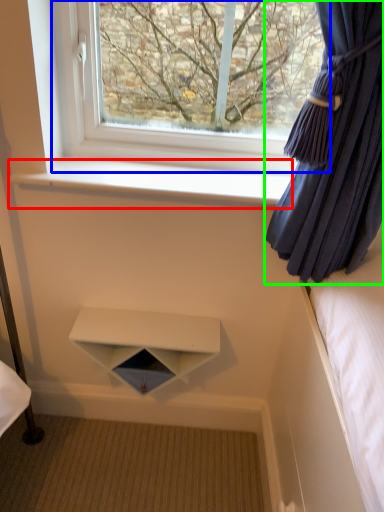
Question: Considering the real-world distances, which object is closest to window sill (highlighted by a red box)? window (highlighted by a blue box) or curtain (highlighted by a green box).

Choices:
 (A) window
 (B) curtain

Answer: (A)